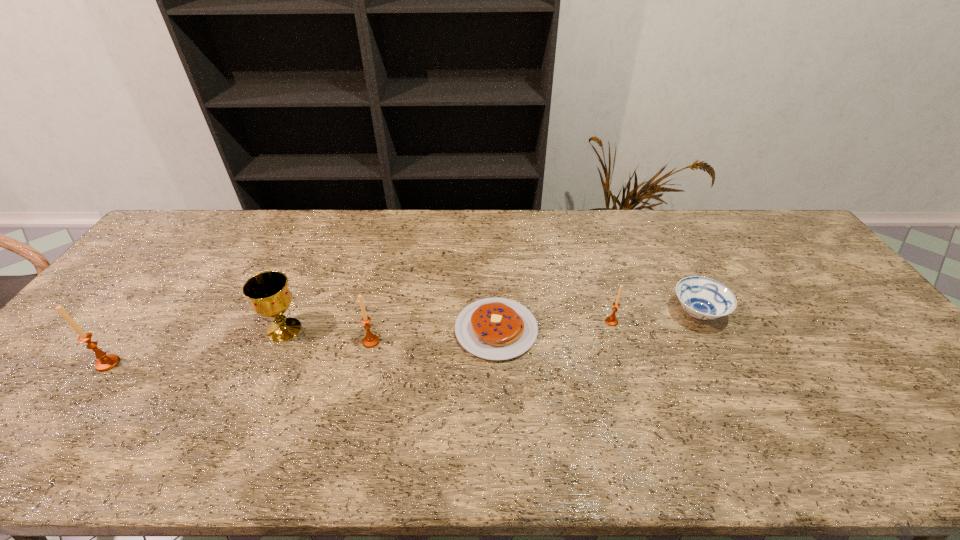
Where is `free space between the third object from right to left and the fifth object from right to left`? free space between the third object from right to left and the fifth object from right to left is located at coordinates (391, 330).

At what (x,y) coordinates should I click in order to perform the action: click on the fourth closest object to the leftmost candle_holder. Please return your answer as a coordinate pair (x, y). This screenshot has height=540, width=960. Looking at the image, I should click on (611, 320).

Identify which object is the fifth closest to the farthest candle_holder. Please provide its 2D coordinates. Your answer should be formatted as a tuple, i.e. [(x, y)], where the tuple contains the x and y coordinates of a point satisfying the conditions above.

[(105, 362)]

The image size is (960, 540). I want to click on candle_holder that is the closest to the fourth tallest object, so click(x=371, y=340).

This screenshot has height=540, width=960. In order to click on candle_holder that is the closest one to the second shortest candle_holder in this screenshot , I will do `click(105, 362)`.

This screenshot has width=960, height=540. Identify the location of free point that satisfies the following two spatial constraints: 1. on the back side of the second object from right to left; 2. on the left side of the fifth object from right to left. (288, 322).

At what (x,y) coordinates should I click in order to perform the action: click on free region that satisfies the following two spatial constraints: 1. on the front side of the pancake; 2. on the right side of the chalice. Please return your answer as a coordinate pair (x, y). The width and height of the screenshot is (960, 540). Looking at the image, I should click on (284, 330).

The height and width of the screenshot is (540, 960). I want to click on free space that satisfies the following two spatial constraints: 1. on the front side of the shortest object; 2. on the left side of the fifth object from right to left, so click(x=284, y=330).